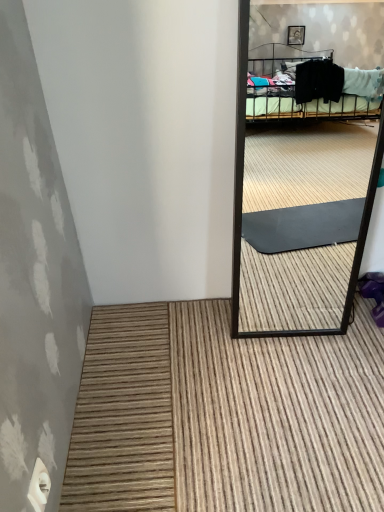
What do you see at coordinates (302, 198) in the screenshot?
I see `black metal mirror at upper right` at bounding box center [302, 198].

Measure the distance between black metal mirror at upper right and camera.

black metal mirror at upper right is 3.50 meters away from camera.

This screenshot has height=512, width=384. Find the location of `black metal mirror at upper right`. black metal mirror at upper right is located at coordinates 302,198.

I want to click on black metal mirror at upper right, so click(302, 198).